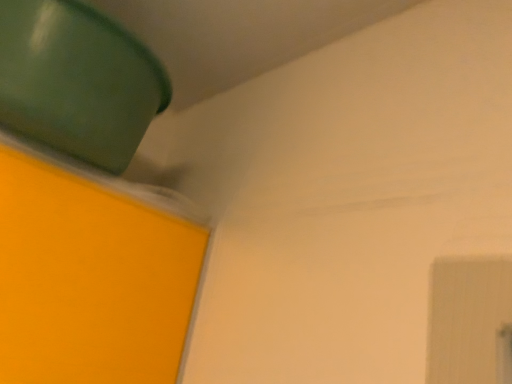
This screenshot has height=384, width=512. Describe the element at coordinates (77, 81) in the screenshot. I see `matte green basin at upper left` at that location.

Find the location of a particular element. matte green basin at upper left is located at coordinates (77, 81).

Where is `matte green basin at upper left`? matte green basin at upper left is located at coordinates (77, 81).